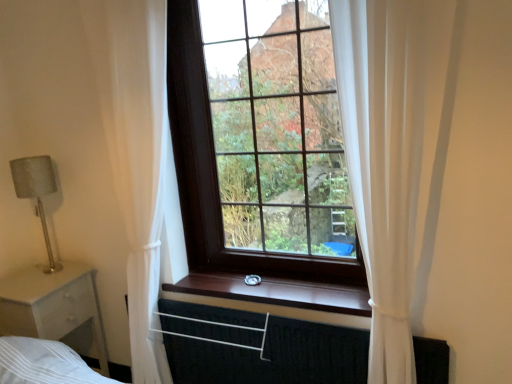
In order to click on free spot above black fabric canopy bed at lower center (from a real-world perspective) in this screenshot , I will do `click(239, 311)`.